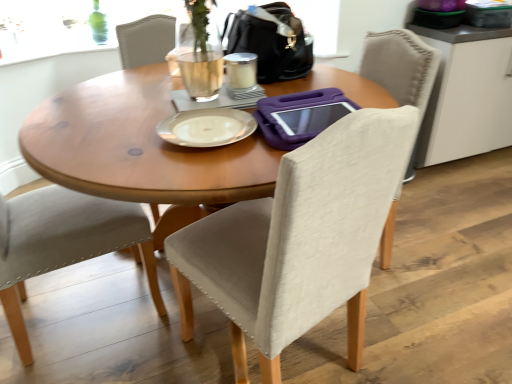
Question: In the image, is light beige fabric chair at left, which is the first chair in left-to-right order, positioned in front of or behind wooden table at center?

Choices:
 (A) behind
 (B) front

Answer: (A)

Question: From a real-world perspective, is light beige fabric chair at left, which appears as the 2th chair when viewed from the right, positioned above or below wooden table at center?

Choices:
 (A) above
 (B) below

Answer: (A)

Question: Based on their relative distances, which object is farther from the white matte cabinet at upper right?

Choices:
 (A) matte glass coffee cup at center
 (B) wooden table at center
 (C) black leather handbag at upper center
 (D) silver metallic plate at center
 (E) light beige fabric chair at left, which is the first chair in left-to-right order

Answer: (E)

Question: Based on their relative distances, which object is nearer to the black leather handbag at upper center?

Choices:
 (A) wooden table at center
 (B) matte glass coffee cup at center
 (C) silver metallic plate at center
 (D) light beige fabric chair at left, which is the first chair in left-to-right order
 (E) beige fabric chair at center, which is counted as the 2th chair, starting from the left

Answer: (B)